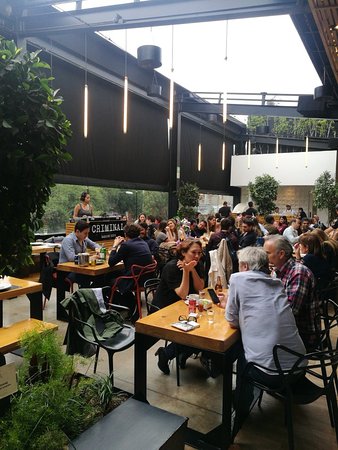
This screenshot has height=450, width=338. I want to click on chairs, so click(x=108, y=348), click(x=137, y=287), click(x=150, y=288), click(x=306, y=390), click(x=323, y=338), click(x=331, y=292), click(x=48, y=274).